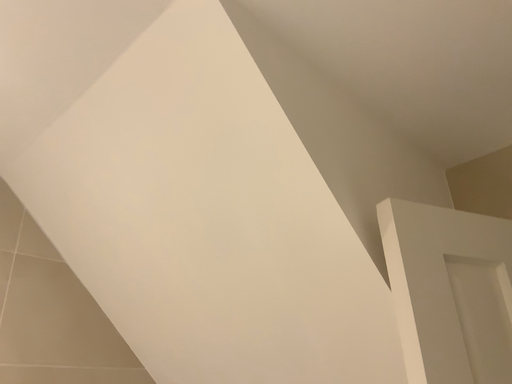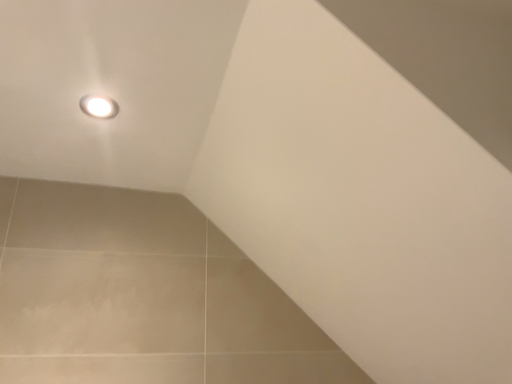
Question: How did the camera likely rotate when shooting the video?

Choices:
 (A) rotated right
 (B) rotated left

Answer: (B)